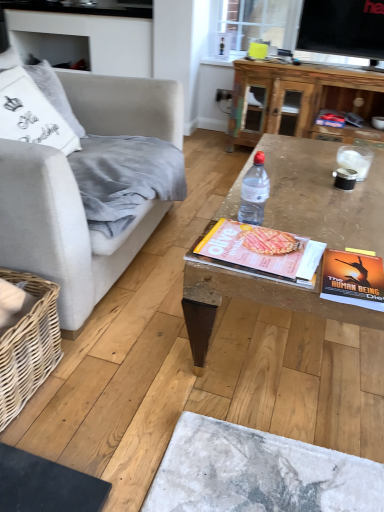
Question: Is wooden coffee table at center turned away from wooden coffee table at upper center?

Choices:
 (A) yes
 (B) no

Answer: (B)

Question: Does wooden coffee table at center come behind wooden coffee table at upper center?

Choices:
 (A) no
 (B) yes

Answer: (A)

Question: Is wooden coffee table at center taller than wooden coffee table at upper center?

Choices:
 (A) yes
 (B) no

Answer: (B)

Question: Is wooden coffee table at center thinner than wooden coffee table at upper center?

Choices:
 (A) no
 (B) yes

Answer: (A)

Question: From a real-world perspective, is wooden coffee table at center located higher than wooden coffee table at upper center?

Choices:
 (A) no
 (B) yes

Answer: (A)

Question: Looking at their shapes, would you say light gray fabric couch at left is wider or thinner than wooden coffee table at upper center?

Choices:
 (A) wide
 (B) thin

Answer: (A)

Question: Is point (105, 248) positioned closer to the camera than point (286, 75)?

Choices:
 (A) closer
 (B) farther

Answer: (A)

Question: In terms of size, does light gray fabric couch at left appear bigger or smaller than wooden coffee table at upper center?

Choices:
 (A) big
 (B) small

Answer: (A)

Question: Is light gray fabric couch at left spatially inside wooden coffee table at upper center, or outside of it?

Choices:
 (A) inside
 (B) outside

Answer: (B)

Question: Is point (200, 313) closer or farther from the camera than point (249, 207)?

Choices:
 (A) farther
 (B) closer

Answer: (B)

Question: Is wooden coffee table at center in front of or behind clear plastic bottle at center in the image?

Choices:
 (A) behind
 (B) front

Answer: (B)

Question: From a real-world perspective, is wooden coffee table at center physically located above or below clear plastic bottle at center?

Choices:
 (A) above
 (B) below

Answer: (B)

Question: Is wooden coffee table at center spatially inside clear plastic bottle at center, or outside of it?

Choices:
 (A) outside
 (B) inside

Answer: (A)

Question: Is clear plastic bottle at center situated inside wooden coffee table at center or outside?

Choices:
 (A) outside
 (B) inside

Answer: (A)

Question: From a real-world perspective, is clear plastic bottle at center physically located above or below wooden coffee table at center?

Choices:
 (A) below
 (B) above

Answer: (B)